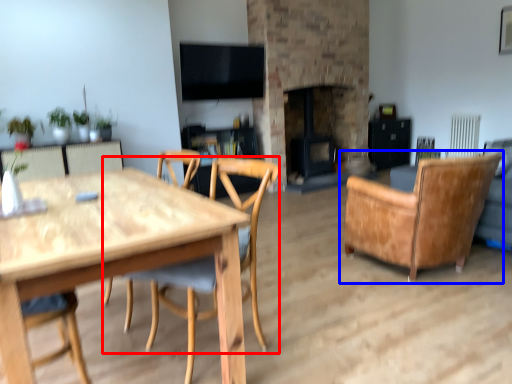
Question: Which object is closer to the camera taking this photo, chair (highlighted by a red box) or chair (highlighted by a blue box)?

Choices:
 (A) chair
 (B) chair

Answer: (A)